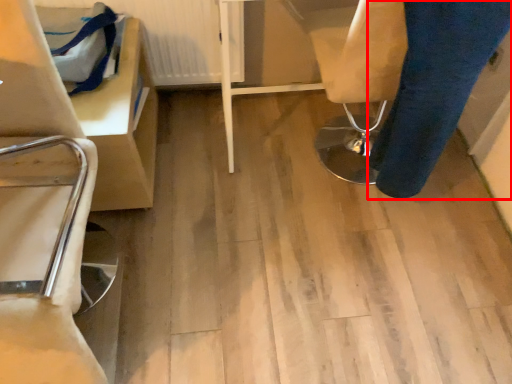
Question: In this image, where is trousers (annotated by the red box) located relative to radiator?

Choices:
 (A) left
 (B) right

Answer: (B)